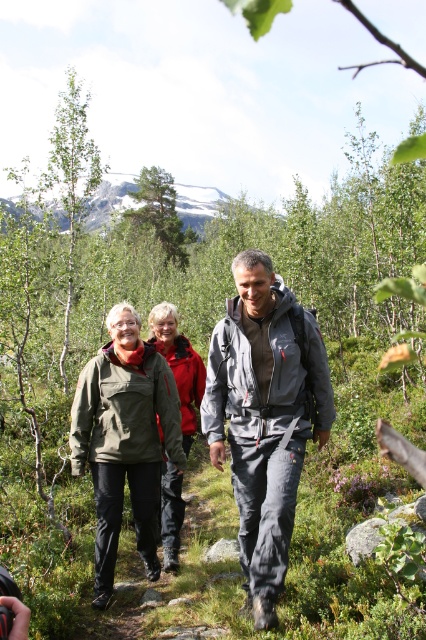
Question: Is gray fabric jacket at center above olive-green fabric jacket at center?

Choices:
 (A) yes
 (B) no

Answer: (A)

Question: Which of the following is the farthest from the observer?

Choices:
 (A) gray fabric jacket at center
 (B) olive-green fabric jacket at center

Answer: (B)

Question: From the image, what is the correct spatial relationship of gray fabric jacket at center in relation to olive-green fabric jacket at center?

Choices:
 (A) above
 (B) below

Answer: (A)

Question: Which object is closer to the camera taking this photo?

Choices:
 (A) gray fabric jacket at center
 (B) olive-green fabric jacket at center

Answer: (A)

Question: Where is gray fabric jacket at center located in relation to olive-green fabric jacket at center in the image?

Choices:
 (A) right
 (B) left

Answer: (A)